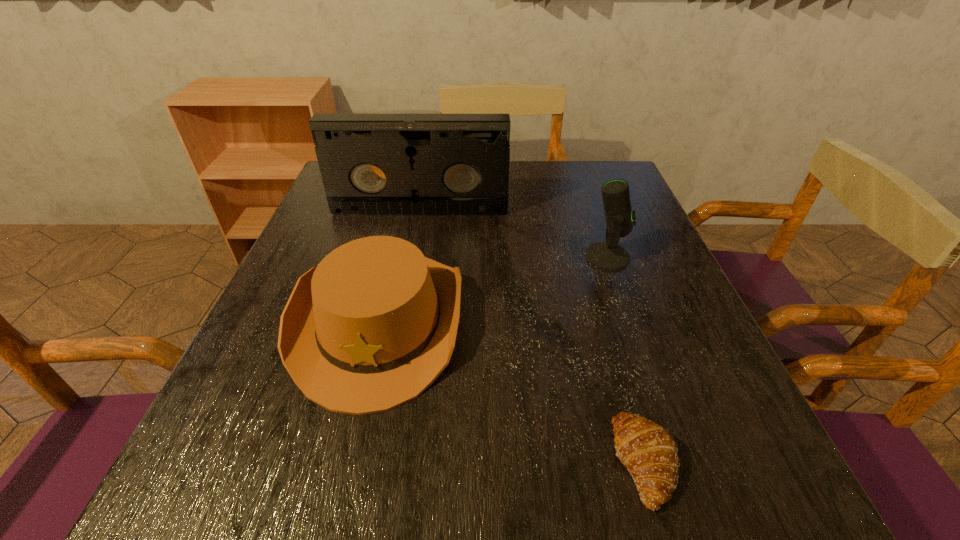
The height and width of the screenshot is (540, 960). In order to click on vacant space at the far right corner of the desktop in this screenshot , I will do `click(632, 204)`.

Find the location of `vacant space that is in between the videotape and the nearest object`. vacant space that is in between the videotape and the nearest object is located at coordinates pos(532,336).

What are the coordinates of `empty location between the farthest object and the nearest object` in the screenshot? It's located at (532, 336).

Identify the location of free area in between the cowboy hat and the microphone. (493, 288).

The height and width of the screenshot is (540, 960). I want to click on free spot between the shortest object and the third shortest object, so click(626, 359).

Identify the location of free spot between the cowboy hat and the nearest object. (512, 390).

This screenshot has width=960, height=540. In order to click on vacant region between the nearest object and the third tallest object in this screenshot , I will do `click(512, 390)`.

Find the location of a particular element. The image size is (960, 540). free space between the farthest object and the crescent roll is located at coordinates (532, 336).

The width and height of the screenshot is (960, 540). Identify the location of free space that is in between the microphone and the tallest object. (514, 234).

Choose which object is the nearest neighbor to the tallest object. Please provide its 2D coordinates. Your answer should be formatted as a tuple, i.e. [(x, y)], where the tuple contains the x and y coordinates of a point satisfying the conditions above.

[(371, 327)]